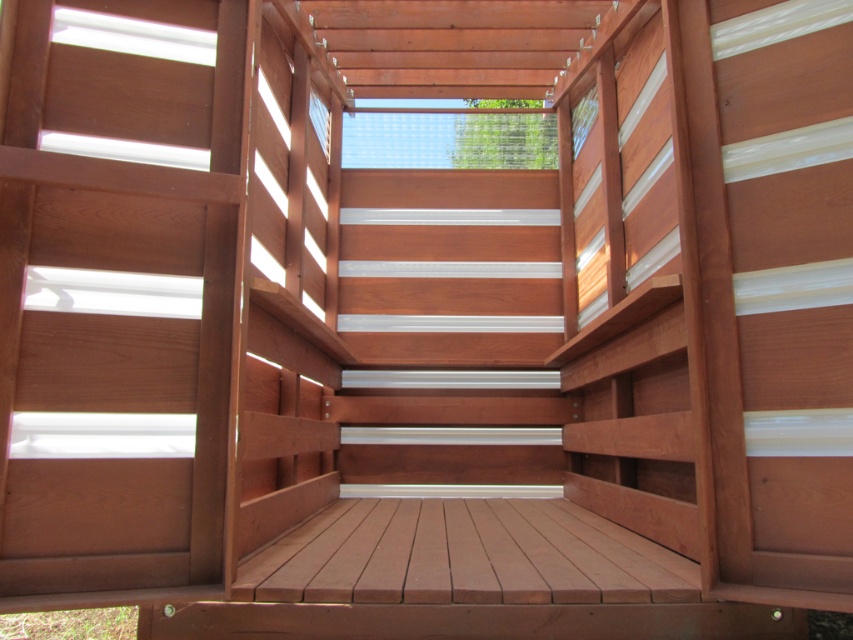
You are standing at the bottom of the stairs in this wooden playhouse. You need to reach the top floor. Which stair should you take first, the satin wood stair at left or the white smooth stair at center?

You should take the satin wood stair at left first because it is located above the white smooth stair at center, meaning it is closer to the top floor and part of the path upwards.

You are standing at the entrance of the wooden structure and want to climb up to the upper level. There are two stairs available, the satin wood stair at left and the white smooth stair at center. Which stair would you choose if you want to take the one that takes up less space?

The satin wood stair at left occupies less space than the white smooth stair at center, so you should choose the satin wood stair at left.